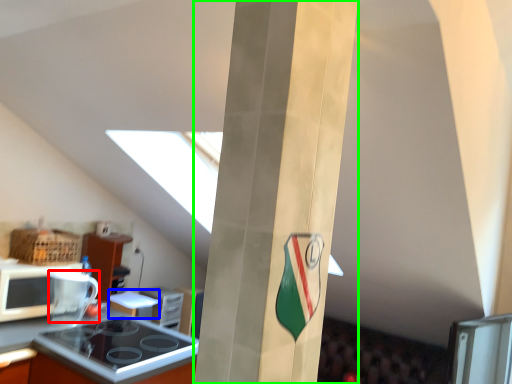
Question: Which object is the closest to the appliance (highlighted by a red box)? Choose among these: appliance (highlighted by a blue box) or pillar (highlighted by a green box).

Choices:
 (A) appliance
 (B) pillar

Answer: (A)